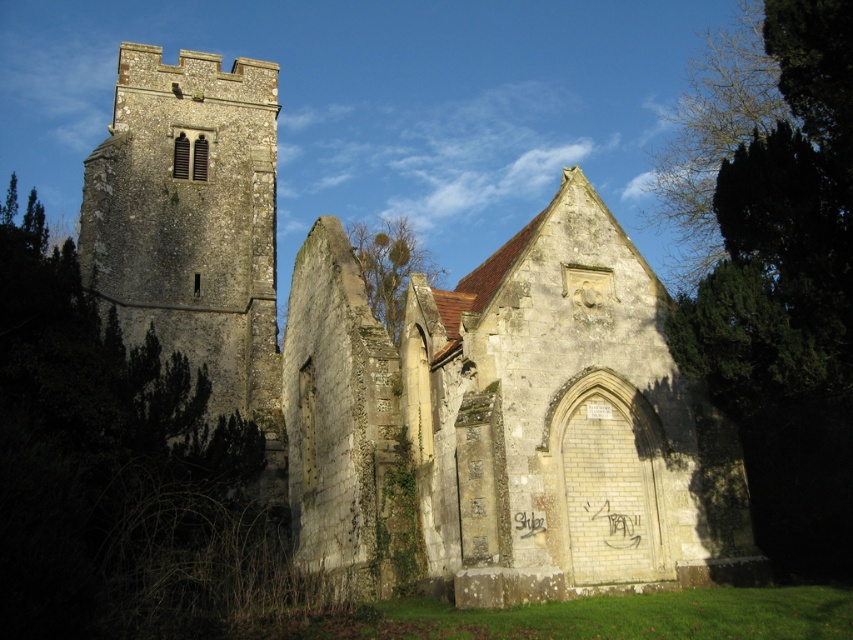
Does green leafy tree at left appear over green leafy tree at center?

Yes.

Which is behind, point (148, 580) or point (374, 300)?

The point (374, 300) is behind.

Find the location of `green leafy tree at left`. green leafy tree at left is located at coordinates coord(114,468).

Can you confirm if green leafy tree at left is positioned to the left of stone tower at left?

Yes, green leafy tree at left is to the left of stone tower at left.

Between green leafy tree at left and stone tower at left, which one is positioned lower?

stone tower at left is lower down.

Which is behind, point (206, 540) or point (131, 104)?

The point (131, 104) is more distant.

You are a GUI agent. You are given a task and a screenshot of the screen. Output one action in this format:
    pyautogui.click(x=<x>, y=<y>)
    Task: Click on the green leafy tree at left
    This screenshot has height=640, width=853.
    Given the screenshot: What is the action you would take?
    pyautogui.click(x=114, y=468)

Is stone church at center smaller than green leafy tree at right?

Yes.

Does stone church at center lie behind green leafy tree at right?

Yes, stone church at center is further from the viewer.

You are a GUI agent. You are given a task and a screenshot of the screen. Output one action in this format:
    pyautogui.click(x=<x>, y=<y>)
    Task: Click on the stone church at center
    
    Given the screenshot: What is the action you would take?
    pyautogui.click(x=416, y=369)